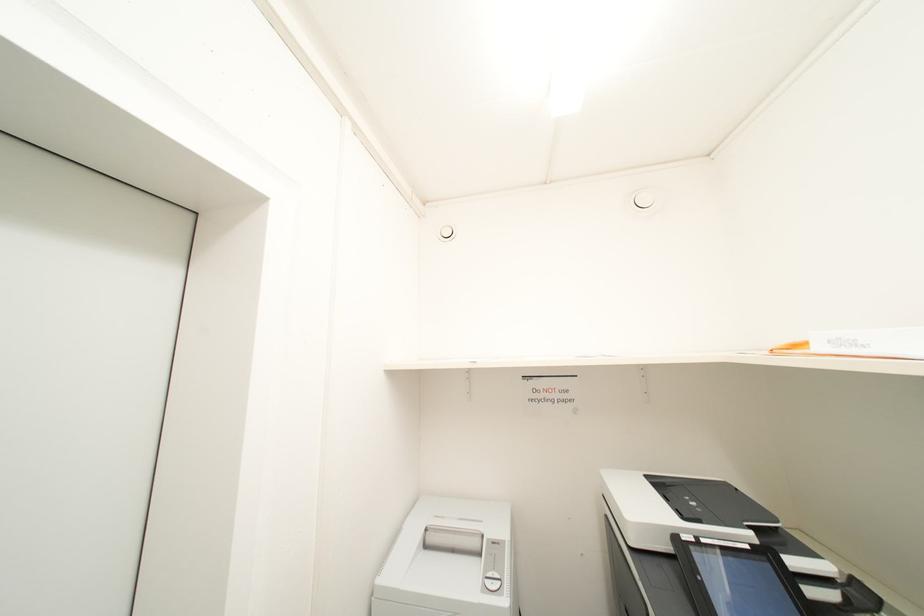
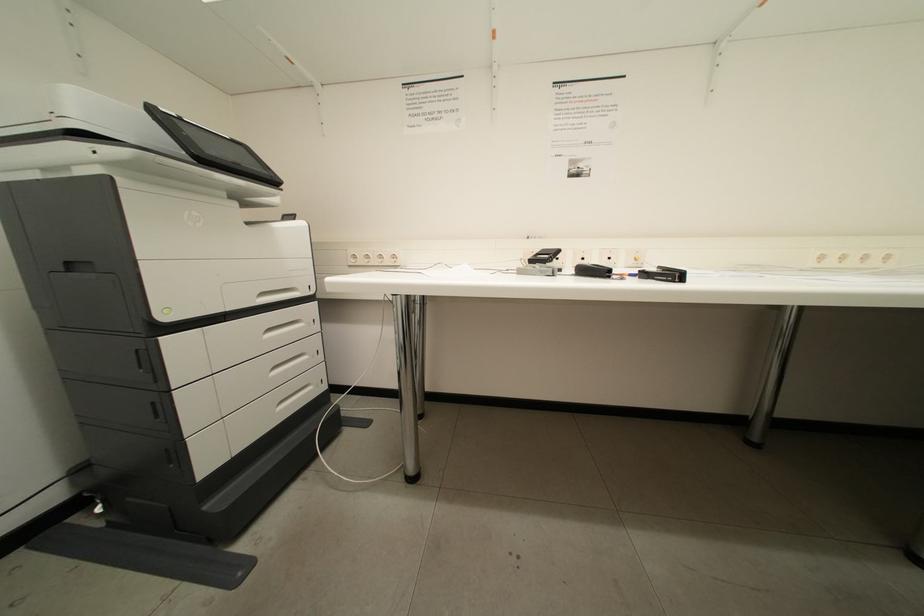
Question: The images are taken continuously from a first-person perspective. In which direction is your viewpoint rotating?

Choices:
 (A) Left
 (B) Right
 (C) Up
 (D) Down

Answer: (B)